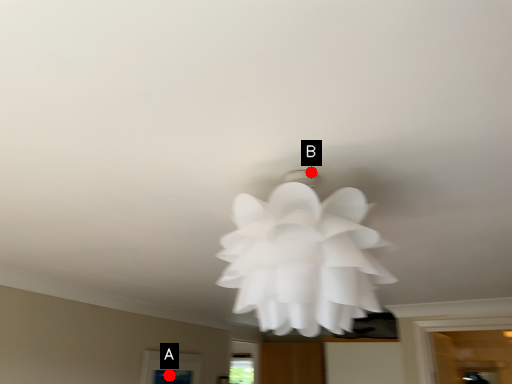
Question: Two points are circled on the image, labeled by A and B beside each circle. Which point is further to the camera?

Choices:
 (A) A is further
 (B) B is further

Answer: (A)